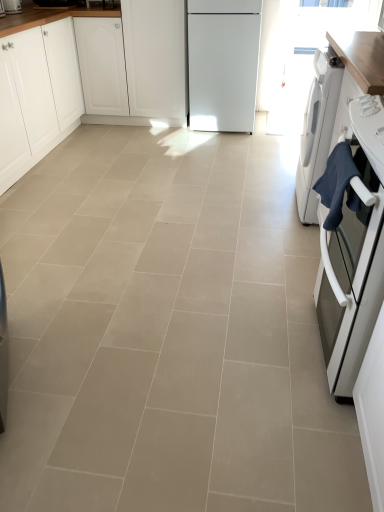
Question: Is matte white toaster at upper left surrounding white glossy washing machine at right, the 2th home appliance when ordered from front to back?

Choices:
 (A) yes
 (B) no

Answer: (B)

Question: Can we say matte white toaster at upper left lies outside white glossy washing machine at right, the 2th home appliance when ordered from front to back?

Choices:
 (A) no
 (B) yes

Answer: (B)

Question: Are matte white toaster at upper left and white glossy washing machine at right, the 2th home appliance when ordered from front to back, far apart?

Choices:
 (A) yes
 (B) no

Answer: (A)

Question: Does matte white toaster at upper left have a greater height compared to white glossy washing machine at right, which is counted as the first home appliance, starting from the back?

Choices:
 (A) no
 (B) yes

Answer: (A)

Question: Is matte white toaster at upper left to the right of white glossy washing machine at right, the 2th home appliance when ordered from front to back, from the viewer's perspective?

Choices:
 (A) no
 (B) yes

Answer: (A)

Question: From the image's perspective, does matte white toaster at upper left appear lower than white glossy washing machine at right, which is counted as the first home appliance, starting from the back?

Choices:
 (A) yes
 (B) no

Answer: (B)

Question: Is white matte cabinet at center, the first cabinetry in the right-to-left sequence, positioned with its back to white glossy oven at right, arranged as the second home appliance when viewed from the back?

Choices:
 (A) no
 (B) yes

Answer: (A)

Question: From the image's perspective, does white matte cabinet at center, placed as the 2th cabinetry when sorted from left to right, appear lower than white glossy oven at right, arranged as the second home appliance when viewed from the back?

Choices:
 (A) no
 (B) yes

Answer: (A)

Question: Is the position of white matte cabinet at center, placed as the 2th cabinetry when sorted from left to right, less distant than that of white glossy oven at right, arranged as the second home appliance when viewed from the back?

Choices:
 (A) no
 (B) yes

Answer: (A)

Question: From a real-world perspective, does white matte cabinet at center, placed as the 2th cabinetry when sorted from left to right, sit lower than white glossy oven at right, arranged as the second home appliance when viewed from the back?

Choices:
 (A) yes
 (B) no

Answer: (B)

Question: Is white matte cabinet at center, the first cabinetry in the right-to-left sequence, aimed at white glossy oven at right, marked as the 1th home appliance in a front-to-back arrangement?

Choices:
 (A) yes
 (B) no

Answer: (B)

Question: Can you confirm if white matte cabinet at center, the first cabinetry in the right-to-left sequence, is bigger than white glossy oven at right, arranged as the second home appliance when viewed from the back?

Choices:
 (A) yes
 (B) no

Answer: (A)

Question: Does beige ceramic tile at center have a smaller size compared to matte white toaster at upper left?

Choices:
 (A) yes
 (B) no

Answer: (B)